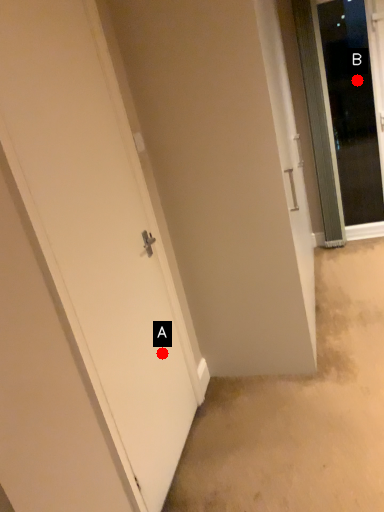
Question: Two points are circled on the image, labeled by A and B beside each circle. Which of the following is the closest to the observer?

Choices:
 (A) A is closer
 (B) B is closer

Answer: (A)